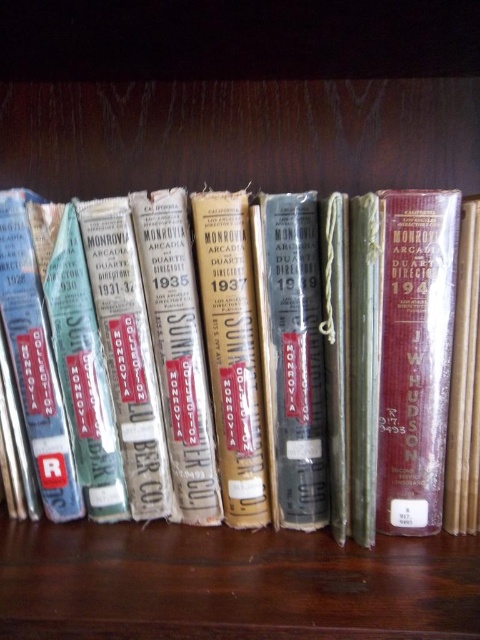
You are standing in front of the wooden shelf at center and want to place the hardcover book at center on it. Can you reach the shelf without moving your position?

The wooden shelf at center is closer to the viewer than the hardcover book at center, so you can easily reach the shelf without moving your position.

You are a librarian who needs to place a new book that is 6 inches wide onto the wooden shelf at center. There is already a hardcover book at center on the shelf. Can the new book fit next to the existing book without overlapping?

The wooden shelf at center and hardcover book at center are 6.64 inches apart from each other. Since the new book is 6 inches wide, there is enough space between the shelf and the existing book to place the new book without overlapping.